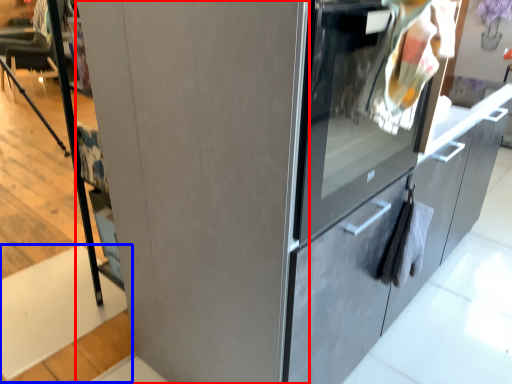
Question: Which point is further to the camera, door (highlighted by a red box) or stair (highlighted by a blue box)?

Choices:
 (A) door
 (B) stair

Answer: (B)